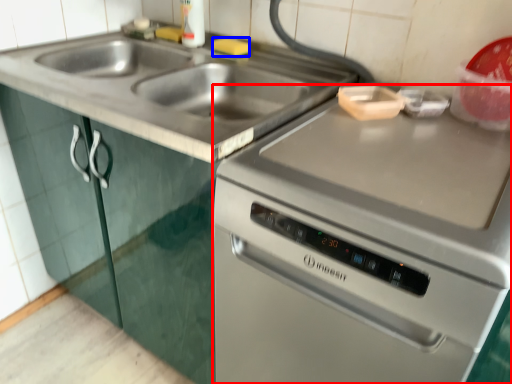
Question: Among these objects, which one is nearest to the camera, oven (highlighted by a red box) or food (highlighted by a blue box)?

Choices:
 (A) oven
 (B) food

Answer: (A)